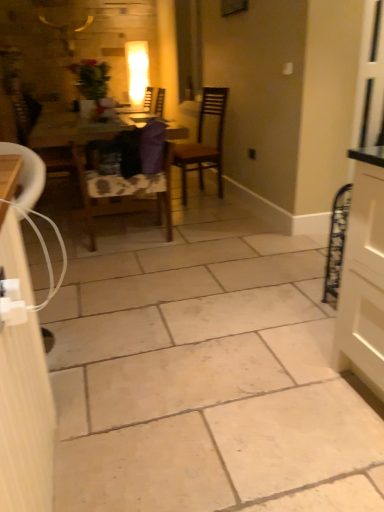
You are a GUI agent. You are given a task and a screenshot of the screen. Output one action in this format:
    pyautogui.click(x=<x>, y=<y>)
    Task: Click on the vacant space in front of wooden chair at center, which is the 2th chair from left to right
    Image resolution: width=384 pixels, height=512 pixels.
    Given the screenshot: What is the action you would take?
    pyautogui.click(x=137, y=263)